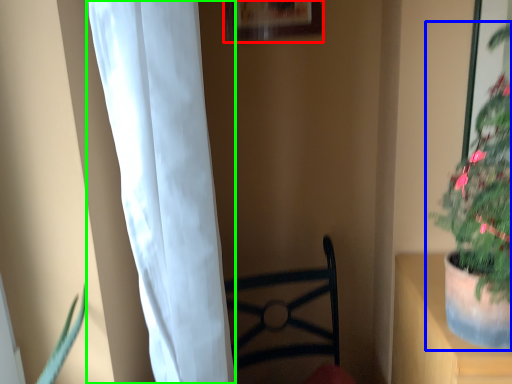
Question: Which object is positioned closest to picture frame (highlighted by a red box)? Select from houseplant (highlighted by a blue box) and curtain (highlighted by a green box).

Choices:
 (A) houseplant
 (B) curtain

Answer: (A)